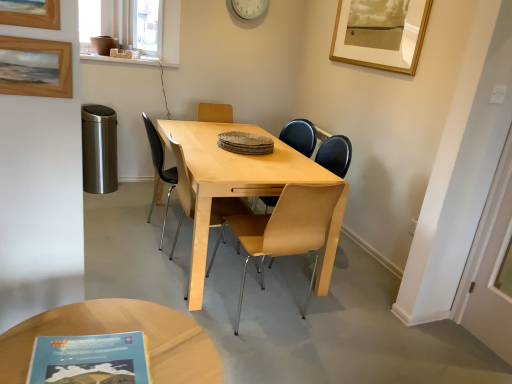
I want to click on free space above light brown wooden coffee table at lower left (from a real-world perspective), so click(110, 334).